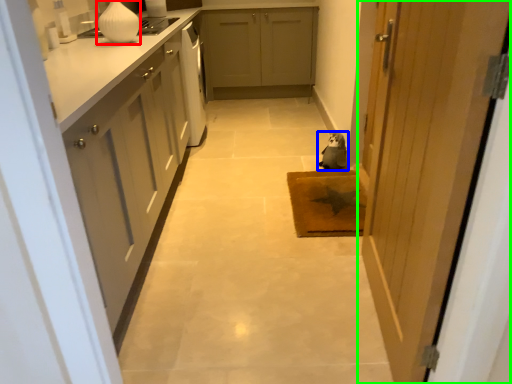
Question: Which object is positioned closest to vase (highlighted by a red box)? Select from animal (highlighted by a blue box) and door (highlighted by a green box).

Choices:
 (A) animal
 (B) door

Answer: (A)